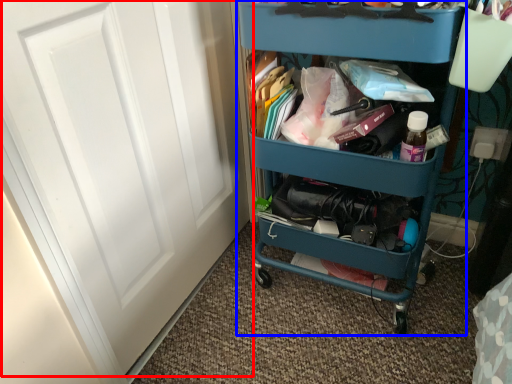
Question: Among these objects, which one is farthest to the camera, door (highlighted by a red box) or furniture (highlighted by a blue box)?

Choices:
 (A) door
 (B) furniture

Answer: (B)